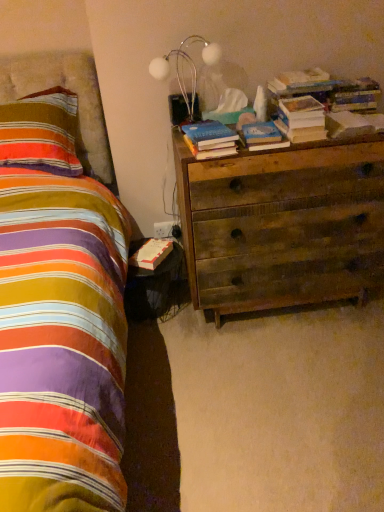
What are the coordinates of `vacant space that's between wooden chest of drawers at right and black glossy nightstand at lower left` in the screenshot? It's located at (167, 326).